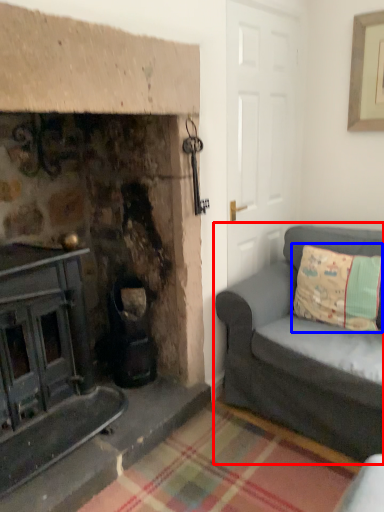
Question: Among these objects, which one is nearest to the camera, studio couch (highlighted by a red box) or pillow (highlighted by a blue box)?

Choices:
 (A) studio couch
 (B) pillow

Answer: (A)